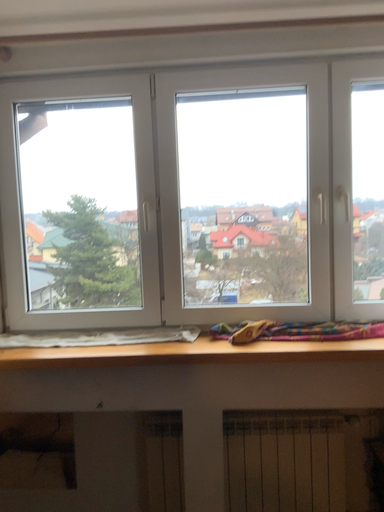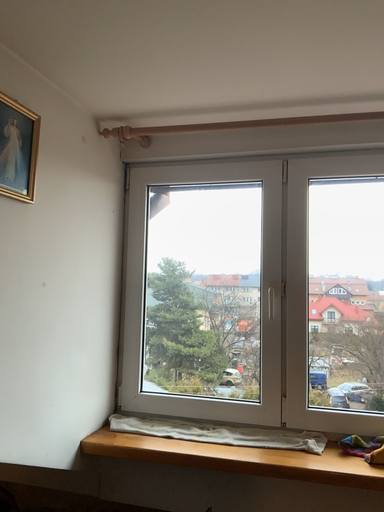
Question: Which way did the camera rotate in the video?

Choices:
 (A) rotated downward
 (B) rotated upward

Answer: (B)